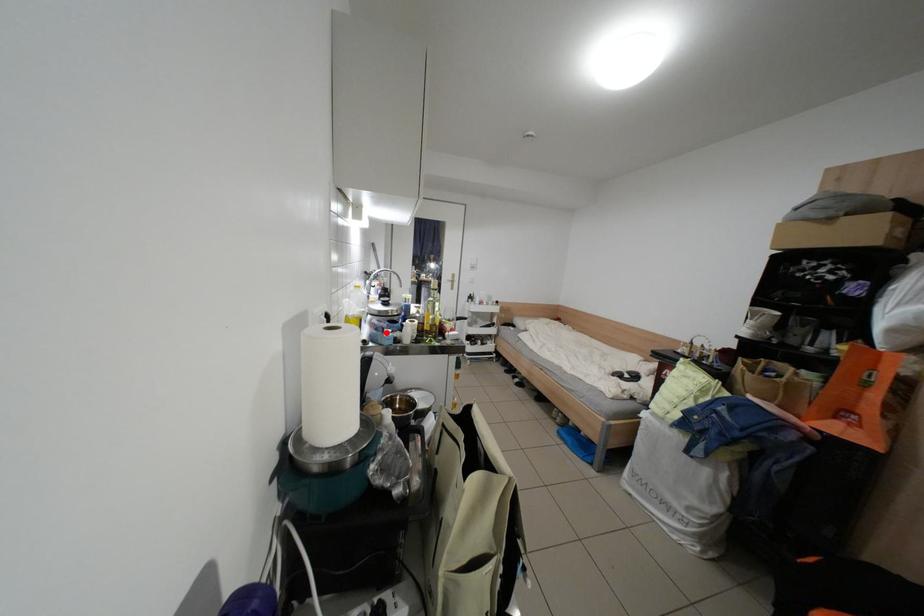
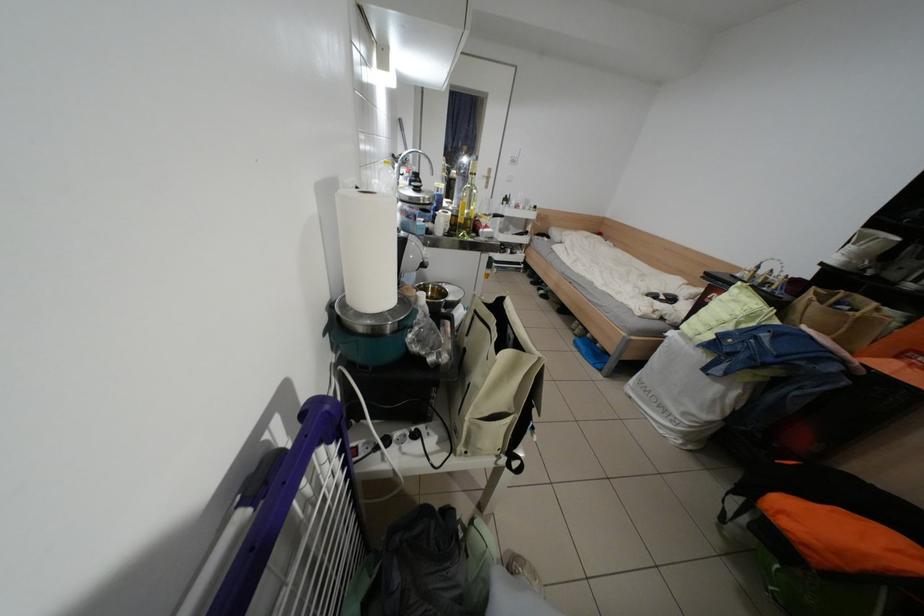
Locate, in the second image, the point that corresponds to the highlighted location in the first image.

(418, 220)